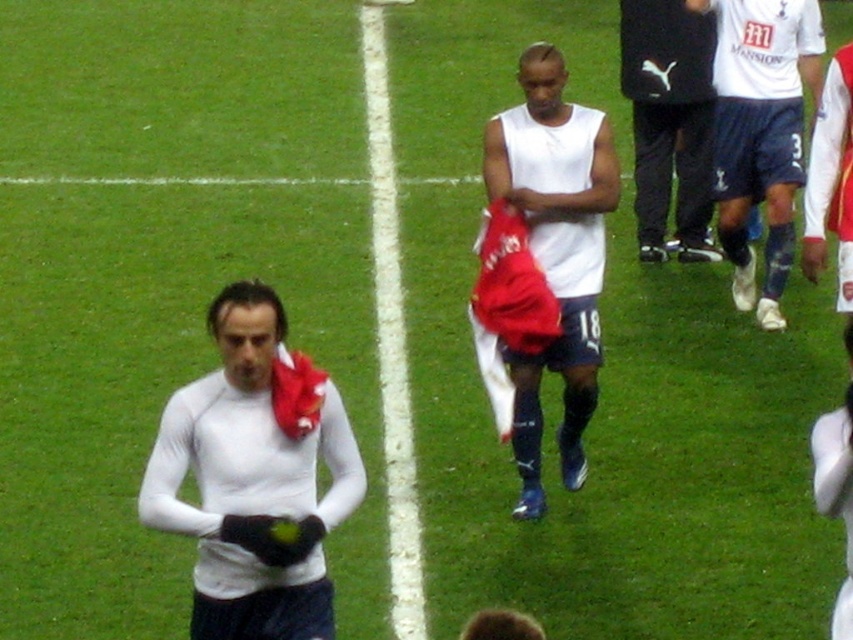
How distant is white jersey at center from black puma tracksuit at center?

19.89 inches

Measure the distance between point (766, 221) and camera.

The distance of point (766, 221) from camera is 11.68 meters.

Does point (776, 176) come farther from viewer compared to point (663, 208)?

No.

Locate an element on the screen. white jersey at center is located at coordinates coord(761,132).

This screenshot has height=640, width=853. Identify the location of white jersey at center. (761, 132).

Is point (750, 273) positioned in front of point (369, 108)?

Yes.

Between point (784, 115) and point (389, 182), which one is positioned in front?

Point (784, 115) is in front.

This screenshot has width=853, height=640. In order to click on white jersey at center in this screenshot , I will do coord(761,132).

Between white matte shirt at center and white matte jersey at center, which one has more height?

white matte jersey at center

Is point (320, 448) positioned in front of point (537, 397)?

Yes, point (320, 448) is in front of point (537, 397).

Who is more forward, (252, 472) or (521, 131)?

Positioned in front is point (252, 472).

At what (x,y) coordinates should I click in order to perform the action: click on white matte shirt at center. Please return your answer as a coordinate pair (x, y). The height and width of the screenshot is (640, 853). Looking at the image, I should click on (254, 476).